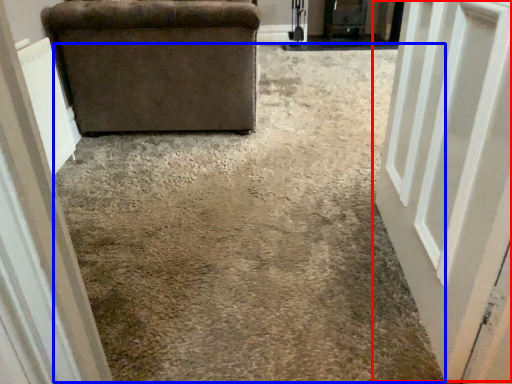
Question: Which object is closer to the camera taking this photo, door (highlighted by a red box) or concrete (highlighted by a blue box)?

Choices:
 (A) door
 (B) concrete

Answer: (A)